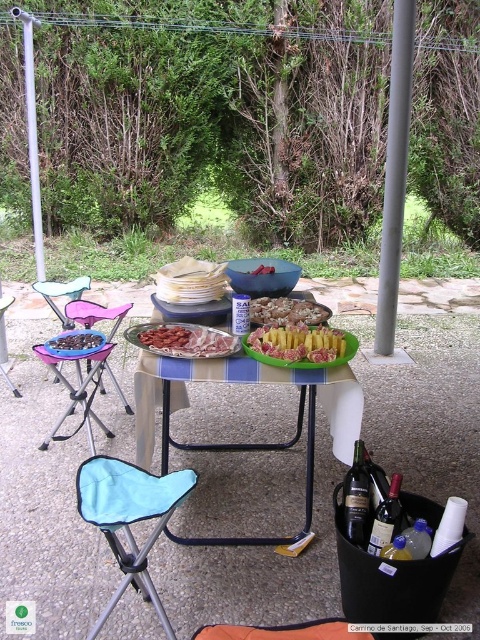
Question: Where is slightly browned bread at center located in relation to smooth red meat at center in the image?

Choices:
 (A) right
 (B) left

Answer: (A)

Question: Which object is positioned closest to the raw pink meat at center?

Choices:
 (A) plastic/metallic table at center
 (B) light blue fabric folding chair at lower left
 (C) pink fabric chair at left

Answer: (A)

Question: Can you confirm if raw pink meat at center is wider than smooth chocolate bar at center?

Choices:
 (A) yes
 (B) no

Answer: (B)

Question: Estimate the real-world distances between objects in this image. Which object is closer to the yellow rubbery pineapple at center?

Choices:
 (A) raw pink meat at center
 (B) slightly browned bread at center
 (C) smooth red meat at center
 (D) light blue fabric folding chair at lower left

Answer: (B)

Question: Is plastic/metallic table at center further to the viewer compared to pink fabric chair at left?

Choices:
 (A) no
 (B) yes

Answer: (A)

Question: Among these points, which one is nearest to the camera?

Choices:
 (A) (300, 348)
 (B) (137, 339)
 (C) (168, 621)

Answer: (C)